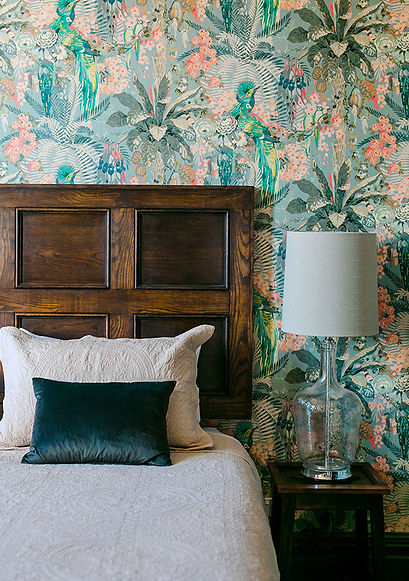
Image resolution: width=409 pixels, height=581 pixels. In order to click on pillow in this screenshot , I will do `click(129, 413)`.